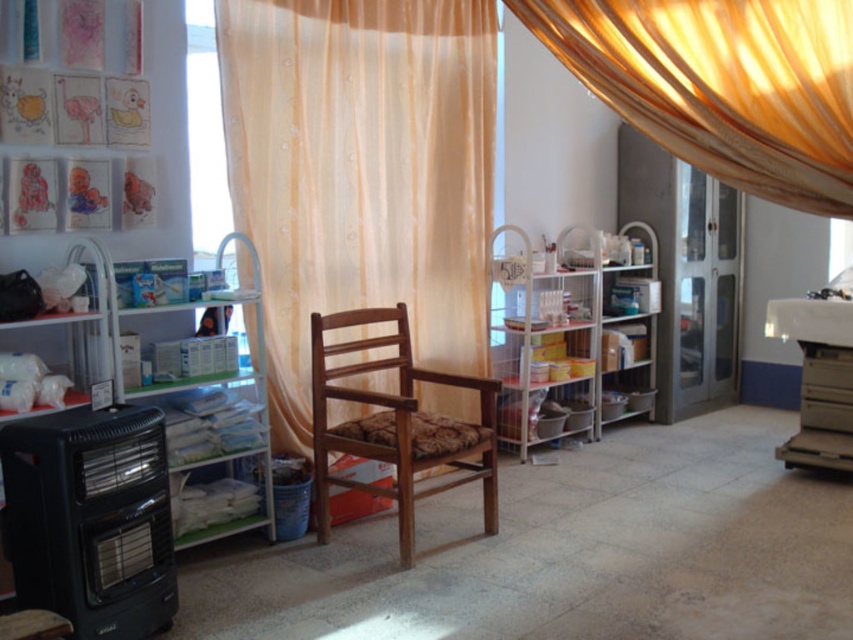
This screenshot has width=853, height=640. Describe the element at coordinates (396, 424) in the screenshot. I see `wooden chair at center` at that location.

Locate an element on the screen. This screenshot has width=853, height=640. wooden chair at center is located at coordinates (396, 424).

Who is shorter, translucent yellowish curtain at center or wooden chair at center?

wooden chair at center

Does translucent yellowish curtain at center appear under wooden chair at center?

No.

Locate an element on the screen. translucent yellowish curtain at center is located at coordinates (361, 172).

Between translucent yellowish curtain at center and translucent yellowish fabric at upper center, which one appears on the left side from the viewer's perspective?

From the viewer's perspective, translucent yellowish curtain at center appears more on the left side.

This screenshot has height=640, width=853. What do you see at coordinates (361, 172) in the screenshot? I see `translucent yellowish curtain at center` at bounding box center [361, 172].

This screenshot has width=853, height=640. Identify the location of translucent yellowish curtain at center. (361, 172).